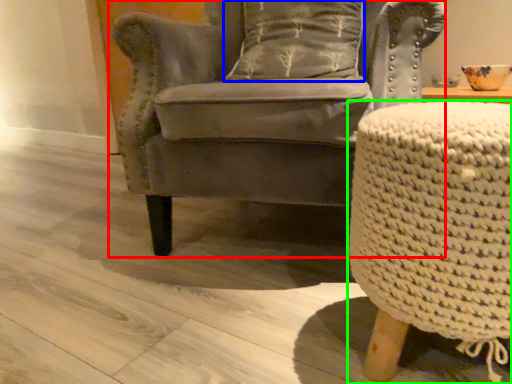
Question: Based on their relative distances, which object is farther from chair (highlighted by a red box)? Choose from pillow (highlighted by a blue box) and table (highlighted by a green box).

Choices:
 (A) pillow
 (B) table

Answer: (B)